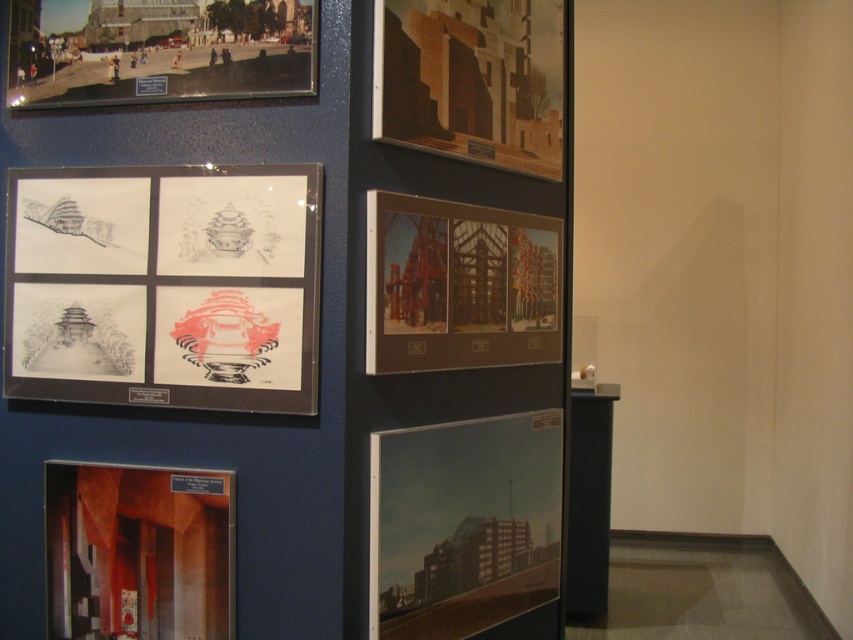
You are standing in front of an art gallery wall displaying architectural drawings and photographs. There is a point marked at coordinates point (64, 618). If you want to touch this point with your hand, which direction should you move your hand relative to your body?

→ The point (64, 618) is 7.30 feet away from you, so you need to extend your hand forward to reach it.